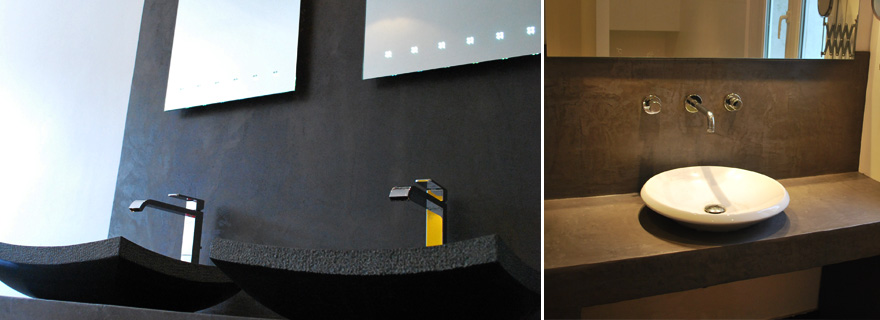
Locate an element on the screen. The image size is (880, 320). backsplash wall is located at coordinates (330, 172), (589, 137).